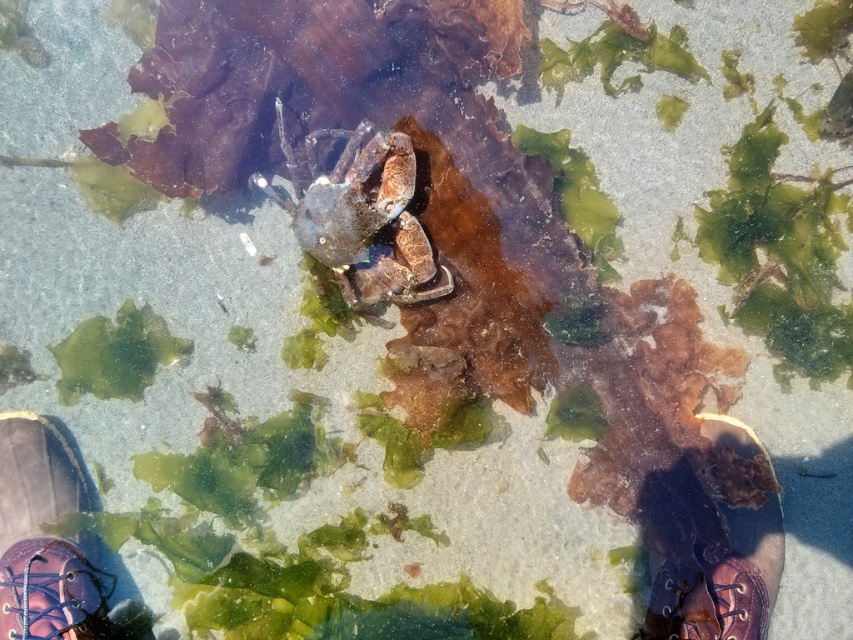
Question: Does shiny purple shoe at lower left have a greater width compared to shiny purple shoe at lower right?

Choices:
 (A) yes
 (B) no

Answer: (B)

Question: Does shiny purple shoe at lower left come in front of shiny purple shoe at lower right?

Choices:
 (A) yes
 (B) no

Answer: (B)

Question: Which of the following is the closest to the observer?

Choices:
 (A) (18, 628)
 (B) (653, 563)

Answer: (A)

Question: Considering the relative positions of shiny purple shoe at lower left and shiny purple shoe at lower right in the image provided, where is shiny purple shoe at lower left located with respect to shiny purple shoe at lower right?

Choices:
 (A) below
 (B) above

Answer: (B)